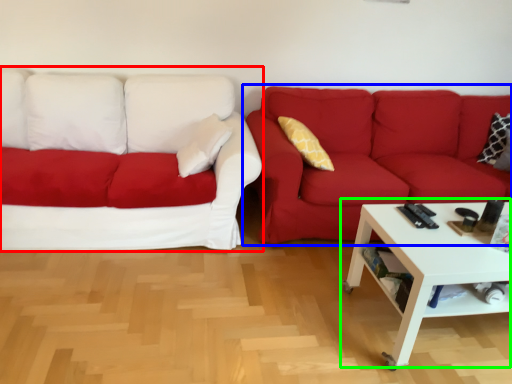
Question: Which object is the closest to the studio couch (highlighted by a red box)? Choose among these: studio couch (highlighted by a blue box) or coffee table (highlighted by a green box).

Choices:
 (A) studio couch
 (B) coffee table

Answer: (A)